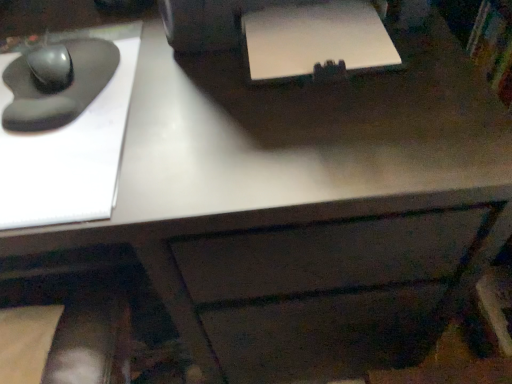
The width and height of the screenshot is (512, 384). I want to click on white matte printer at upper center, so click(x=283, y=34).

Consider the image. Is matte black mouse at left, the second mouse positioned from the top, next to white matte printer at upper center?

No, matte black mouse at left, the second mouse positioned from the top, is not beside white matte printer at upper center.

Considering the relative sizes of matte black mouse at left, the first mouse when ordered from bottom to top, and white matte printer at upper center in the image provided, is matte black mouse at left, the first mouse when ordered from bottom to top, wider than white matte printer at upper center?

Yes.

Between matte black mouse at left, the second mouse positioned from the top, and white matte printer at upper center, which one has less height?

white matte printer at upper center is shorter.

From the picture: From the image's perspective, between matte black mouse at left, the first mouse when ordered from bottom to top, and white matte printer at upper center, who is located below?

matte black mouse at left, the first mouse when ordered from bottom to top, from the image's perspective.

Which object is closer to the camera, matte black mouse at left, positioned as the second mouse in bottom-to-top order, or matte black mouse at left, the second mouse positioned from the top?

matte black mouse at left, the second mouse positioned from the top, is in front.

Can you tell me how much matte black mouse at left, positioned as the second mouse in bottom-to-top order, and matte black mouse at left, the first mouse when ordered from bottom to top, differ in facing direction?

They differ by 0.000607 degrees in their facing directions.

The image size is (512, 384). What are the coordinates of `mouse lying in front of the matte black mouse at left, placed as the 1th mouse when sorted from top to bottom` in the screenshot? It's located at (57, 83).

Can you confirm if matte black mouse at left, positioned as the second mouse in bottom-to-top order, is taller than matte black mouse at left, the second mouse positioned from the top?

Yes.

Does matte black mouse at left, the first mouse when ordered from bottom to top, have a larger size compared to matte black mouse at left, positioned as the second mouse in bottom-to-top order?

Yes.

Considering the positions of objects matte black mouse at left, the second mouse positioned from the top, and matte black mouse at left, placed as the 1th mouse when sorted from top to bottom, in the image provided, who is in front, matte black mouse at left, the second mouse positioned from the top, or matte black mouse at left, placed as the 1th mouse when sorted from top to bottom,?

matte black mouse at left, the second mouse positioned from the top, is more forward.

Find the location of a particular element. The height and width of the screenshot is (384, 512). mouse in front of the matte black mouse at left, positioned as the second mouse in bottom-to-top order is located at coordinates (57, 83).

Is white matte printer at upper center situated inside matte black mouse at left, positioned as the second mouse in bottom-to-top order, or outside?

white matte printer at upper center is not enclosed by matte black mouse at left, positioned as the second mouse in bottom-to-top order.

Is white matte printer at upper center smaller than matte black mouse at left, positioned as the second mouse in bottom-to-top order?

No, white matte printer at upper center is not smaller than matte black mouse at left, positioned as the second mouse in bottom-to-top order.

Considering the relative positions of white matte printer at upper center and matte black mouse at left, positioned as the second mouse in bottom-to-top order, in the image provided, is white matte printer at upper center to the right of matte black mouse at left, positioned as the second mouse in bottom-to-top order, from the viewer's perspective?

Yes, white matte printer at upper center is to the right of matte black mouse at left, positioned as the second mouse in bottom-to-top order.

Is white matte printer at upper center looking in the opposite direction of matte black mouse at left, placed as the 1th mouse when sorted from top to bottom?

No, white matte printer at upper center is not facing away from matte black mouse at left, placed as the 1th mouse when sorted from top to bottom.

From a real-world perspective, is matte black mouse at left, placed as the 1th mouse when sorted from top to bottom, physically above white matte printer at upper center?

Actually, matte black mouse at left, placed as the 1th mouse when sorted from top to bottom, is physically below white matte printer at upper center in the real world.

Based on their positions, is matte black mouse at left, positioned as the second mouse in bottom-to-top order, located to the left or right of white matte printer at upper center?

In the image, matte black mouse at left, positioned as the second mouse in bottom-to-top order, appears on the left side of white matte printer at upper center.

How much distance is there between matte black mouse at left, placed as the 1th mouse when sorted from top to bottom, and white matte printer at upper center?

matte black mouse at left, placed as the 1th mouse when sorted from top to bottom, is 12.47 inches from white matte printer at upper center.

Does matte black mouse at left, placed as the 1th mouse when sorted from top to bottom, lie behind white matte printer at upper center?

Yes.

Is point (191, 45) behind point (59, 48)?

No.

In terms of width, does white matte printer at upper center look wider or thinner when compared to matte black mouse at left, the first mouse when ordered from bottom to top?

In the image, white matte printer at upper center appears to be more narrow than matte black mouse at left, the first mouse when ordered from bottom to top.

Locate an element on the screen. Image resolution: width=512 pixels, height=384 pixels. printer that appears behind the matte black mouse at left, the first mouse when ordered from bottom to top is located at coordinates (283, 34).

Does white matte printer at upper center contain matte black mouse at left, the second mouse positioned from the top?

No.

From a real-world perspective, which mouse is the 2nd one underneath the white matte printer at upper center? Please provide its 2D coordinates.

[(57, 83)]

Where is `mouse that appears below the matte black mouse at left, positioned as the second mouse in bottom-to-top order (from the image's perspective)`? mouse that appears below the matte black mouse at left, positioned as the second mouse in bottom-to-top order (from the image's perspective) is located at coordinates (57, 83).

Estimate the real-world distances between objects in this image. Which object is closer to matte black mouse at left, the first mouse when ordered from bottom to top, matte black mouse at left, positioned as the second mouse in bottom-to-top order, or white matte printer at upper center?

matte black mouse at left, positioned as the second mouse in bottom-to-top order.

Estimate the real-world distances between objects in this image. Which object is further from white matte printer at upper center, matte black mouse at left, placed as the 1th mouse when sorted from top to bottom, or matte black mouse at left, the second mouse positioned from the top?

matte black mouse at left, placed as the 1th mouse when sorted from top to bottom.

Looking at this image, from the image, which object appears to be farther from matte black mouse at left, positioned as the second mouse in bottom-to-top order, white matte printer at upper center or matte black mouse at left, the first mouse when ordered from bottom to top?

white matte printer at upper center.

Estimate the real-world distances between objects in this image. Which object is further from matte black mouse at left, the first mouse when ordered from bottom to top, white matte printer at upper center or matte black mouse at left, positioned as the second mouse in bottom-to-top order?

Among the two, white matte printer at upper center is located further to matte black mouse at left, the first mouse when ordered from bottom to top.

Which object lies further to the anchor point matte black mouse at left, positioned as the second mouse in bottom-to-top order, matte black mouse at left, the second mouse positioned from the top, or white matte printer at upper center?

white matte printer at upper center is further to matte black mouse at left, positioned as the second mouse in bottom-to-top order.

Based on their spatial positions, is matte black mouse at left, the first mouse when ordered from bottom to top, or matte black mouse at left, placed as the 1th mouse when sorted from top to bottom, further from white matte printer at upper center?

matte black mouse at left, placed as the 1th mouse when sorted from top to bottom, is further to white matte printer at upper center.

Locate an element on the screen. This screenshot has width=512, height=384. mouse situated between matte black mouse at left, the first mouse when ordered from bottom to top, and white matte printer at upper center from left to right is located at coordinates (50, 67).